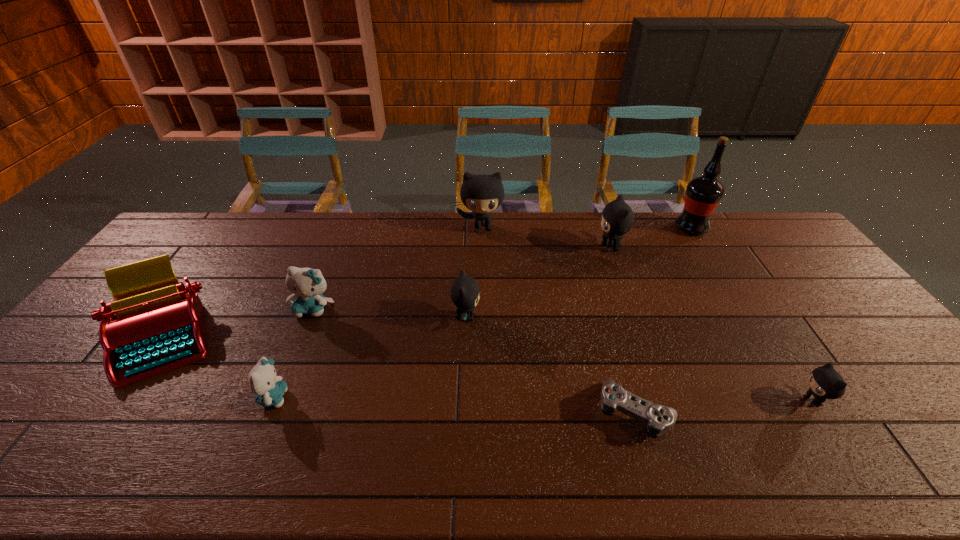
Image resolution: width=960 pixels, height=540 pixels. I want to click on the rightmost gray kitten, so click(x=825, y=382).

This screenshot has height=540, width=960. Find the location of `the nearest gray kitten`. the nearest gray kitten is located at coordinates (825, 382).

Where is `control`? The height and width of the screenshot is (540, 960). control is located at coordinates (659, 419).

This screenshot has height=540, width=960. What are the coordinates of `the shortest object` in the screenshot? It's located at (659, 419).

The image size is (960, 540). What are the coordinates of `vacant space situated on the left of the wine bottle` in the screenshot? It's located at (585, 228).

Identify the location of free space located 0.140m on the front-facing side of the tallest kitten. (483, 262).

This screenshot has width=960, height=540. I want to click on blank space located 0.140m on the front-facing side of the second gray kitten from right to left, so click(x=556, y=248).

Locate an element on the screen. The width and height of the screenshot is (960, 540). free space located on the front-facing side of the second gray kitten from right to left is located at coordinates (484, 248).

Locate an element on the screen. The width and height of the screenshot is (960, 540). free spot located on the front-facing side of the second gray kitten from right to left is located at coordinates (513, 248).

Where is `free space located 0.230m on the face of the bigger blue kitten`? free space located 0.230m on the face of the bigger blue kitten is located at coordinates (281, 388).